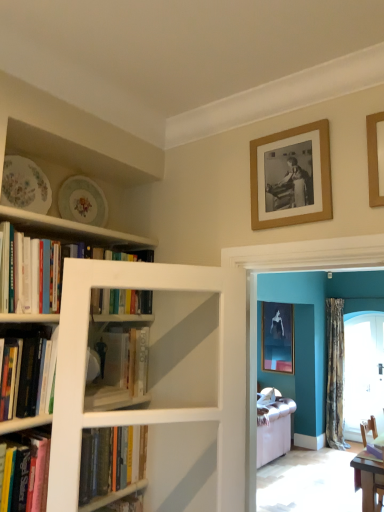
Question: From a real-world perspective, is porcelain floral plate at upper left, which is the first plate in back-to-front order, below wooden picture frame at upper right, the 1th picture frame viewed from the top?

Choices:
 (A) no
 (B) yes

Answer: (B)

Question: From a real-world perspective, is porcelain floral plate at upper left, marked as the second plate in a front-to-back arrangement, positioned over wooden picture frame at upper right, arranged as the 1th picture frame when viewed from the front, based on gravity?

Choices:
 (A) yes
 (B) no

Answer: (B)

Question: Could wooden picture frame at upper right, the second picture frame viewed from the right, be considered to be inside porcelain floral plate at upper left, marked as the second plate in a front-to-back arrangement?

Choices:
 (A) no
 (B) yes

Answer: (A)

Question: Is porcelain floral plate at upper left, which is the second plate from left to right, closer to camera compared to wooden picture frame at upper right, the 3th picture frame when ordered from back to front?

Choices:
 (A) no
 (B) yes

Answer: (A)

Question: From the image's perspective, does porcelain floral plate at upper left, which is the first plate in back-to-front order, appear lower than wooden picture frame at upper right, the second picture frame viewed from the right?

Choices:
 (A) yes
 (B) no

Answer: (A)

Question: Considering the positions of hardcover book at left, the 2th book when ordered from bottom to top, and hardcover book at center, acting as the 3th book starting from the bottom, in the image, is hardcover book at left, the 2th book when ordered from bottom to top, taller or shorter than hardcover book at center, acting as the 3th book starting from the bottom,?

Choices:
 (A) short
 (B) tall

Answer: (A)

Question: From a real-world perspective, is hardcover book at left, the 2th book when ordered from bottom to top, physically located above or below hardcover book at center, acting as the 3th book starting from the bottom?

Choices:
 (A) below
 (B) above

Answer: (A)

Question: Considering the positions of hardcover book at left, the 2th book when ordered from bottom to top, and hardcover book at center, acting as the 3th book starting from the bottom, in the image, is hardcover book at left, the 2th book when ordered from bottom to top, wider or thinner than hardcover book at center, acting as the 3th book starting from the bottom,?

Choices:
 (A) wide
 (B) thin

Answer: (A)

Question: Considering the positions of hardcover book at left, the 2th book when ordered from bottom to top, and hardcover book at center, the 3th book viewed from the top, in the image, is hardcover book at left, the 2th book when ordered from bottom to top, bigger or smaller than hardcover book at center, the 3th book viewed from the top,?

Choices:
 (A) small
 (B) big

Answer: (B)

Question: From a real-world perspective, relative to wooden chair at lower right, is matte black picture frame at upper center, positioned as the third picture frame in top-to-bottom order, vertically above or below?

Choices:
 (A) above
 (B) below

Answer: (A)

Question: In the image, is matte black picture frame at upper center, positioned as the 3th picture frame in left-to-right order, positioned in front of or behind wooden chair at lower right?

Choices:
 (A) front
 (B) behind

Answer: (B)

Question: Is point (292, 366) closer or farther from the camera than point (365, 430)?

Choices:
 (A) farther
 (B) closer

Answer: (A)

Question: Based on their positions, is matte black picture frame at upper center, positioned as the 3th picture frame in left-to-right order, located to the left or right of wooden chair at lower right?

Choices:
 (A) right
 (B) left

Answer: (B)

Question: From a real-world perspective, is camouflage fabric curtain at right above or below hardcover book at center, the first book positioned from the bottom?

Choices:
 (A) above
 (B) below

Answer: (B)

Question: In the image, is camouflage fabric curtain at right on the left side or the right side of hardcover book at center, marked as the fifth book in a top-to-bottom arrangement?

Choices:
 (A) left
 (B) right

Answer: (B)